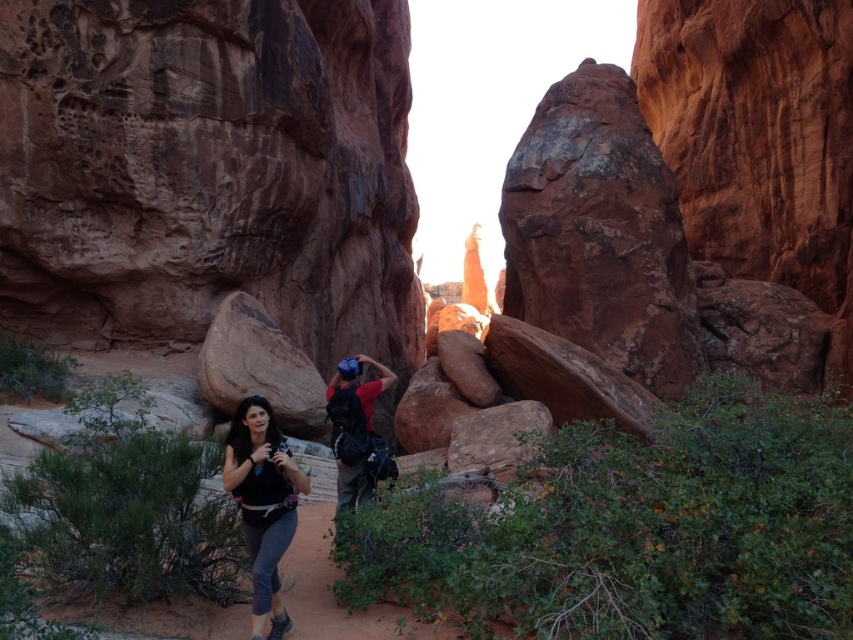
Which is behind, point (577, 113) or point (251, 412)?

The point (577, 113) is more distant.

Can you confirm if reddish-brown textured rock at center-right is positioned above matte black tank top at center?

Indeed, reddish-brown textured rock at center-right is positioned over matte black tank top at center.

What do you see at coordinates (601, 234) in the screenshot? The width and height of the screenshot is (853, 640). I see `reddish-brown textured rock at center-right` at bounding box center [601, 234].

Identify the location of reddish-brown textured rock at center-right. The height and width of the screenshot is (640, 853). (601, 234).

Is rustic sandstone boulder at center positioned before matte black tank top at center?

No, rustic sandstone boulder at center is behind matte black tank top at center.

This screenshot has height=640, width=853. Describe the element at coordinates (209, 172) in the screenshot. I see `rustic sandstone boulder at center` at that location.

Locate an element on the screen. The width and height of the screenshot is (853, 640). rustic sandstone boulder at center is located at coordinates (209, 172).

Is point (537, 320) less distant than point (341, 467)?

No.

Can you confirm if reddish-brown textured rock at center-right is positioned to the left of matte red shirt at center?

In fact, reddish-brown textured rock at center-right is to the right of matte red shirt at center.

The height and width of the screenshot is (640, 853). What do you see at coordinates (601, 234) in the screenshot?
I see `reddish-brown textured rock at center-right` at bounding box center [601, 234].

Find the location of `reddish-brown textured rock at center-right`. reddish-brown textured rock at center-right is located at coordinates (601, 234).